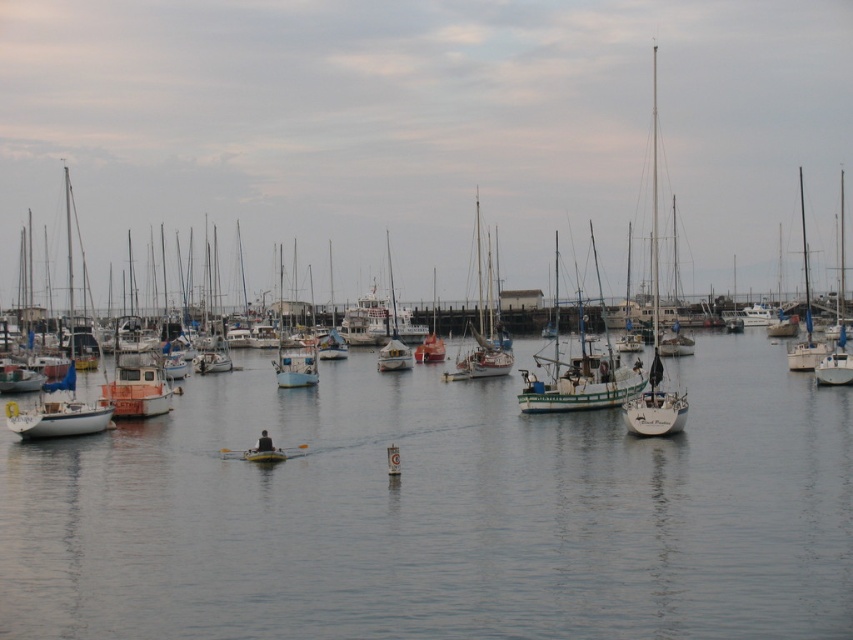
Question: Can you confirm if white wooden sailboat at center is positioned to the right of white matte sailboat at right?

Choices:
 (A) no
 (B) yes

Answer: (A)

Question: In this image, where is clear water at center located relative to white wooden sailboat at center?

Choices:
 (A) left
 (B) right

Answer: (A)

Question: Which is farther from the white matte sailboat at right?

Choices:
 (A) white wooden sailboat at center
 (B) clear water at center

Answer: (B)

Question: Which object is positioned closest to the clear water at center?

Choices:
 (A) white matte sailboat at right
 (B) white wooden sailboat at center

Answer: (A)

Question: Is white wooden sailboat at center to the right of white matte sailboat at right from the viewer's perspective?

Choices:
 (A) yes
 (B) no

Answer: (B)

Question: Which of the following is the closest to the observer?

Choices:
 (A) white wooden sailboat at center
 (B) clear water at center

Answer: (B)